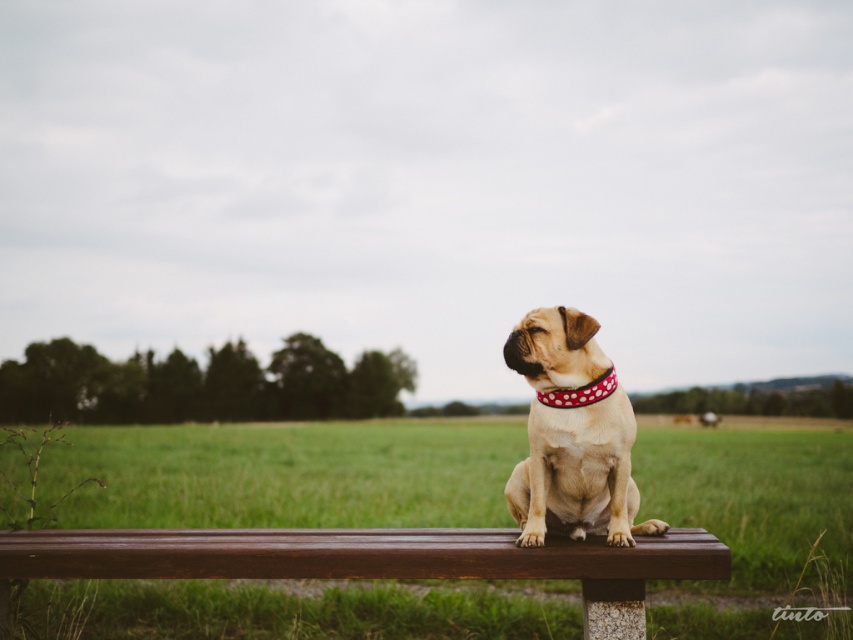
You are a photographer trying to capture the small dog sitting on the brown wooden bench at center. You notice the red dotted fabric neckband at center in your shot. Where should you adjust your camera to focus on the dog without the neckband appearing in the frame?

The brown wooden bench at center is located below the red dotted fabric neckband at center, so you should aim your camera slightly downward to focus on the dog on the bench while avoiding the neckband above.

You are a photographer trying to capture the perfect shot of the brown wooden bench at center and the red dotted fabric neckband at center. To ensure both are in frame, you need to know their relative positions. Which object is positioned to the right?

The red dotted fabric neckband at center is to the right of the brown wooden bench at center.